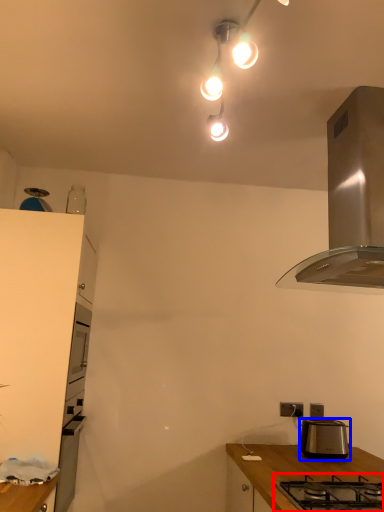
Question: Which object appears farthest to the camera in this image, gas stove (highlighted by a red box) or toaster (highlighted by a blue box)?

Choices:
 (A) gas stove
 (B) toaster

Answer: (B)